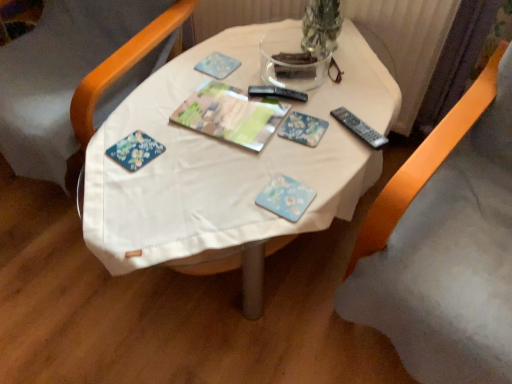
The width and height of the screenshot is (512, 384). In order to click on vacant region in front of black plastic remote at right in this screenshot , I will do `click(332, 168)`.